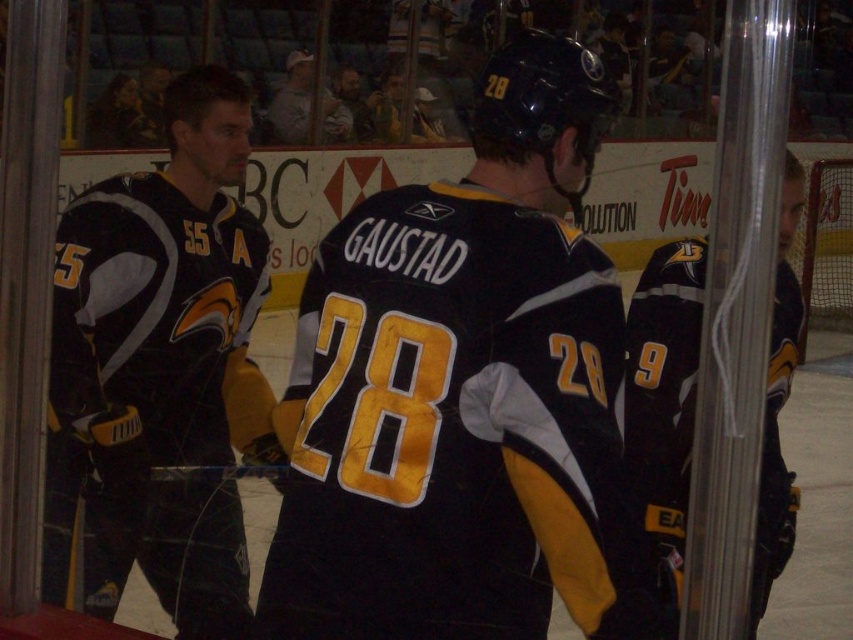
You are a spectator at the hockey game and want to take a photo of both the black jersey at left and the gray cotton shirt at upper center. Which one should you zoom in on first to ensure it fits in the frame?

The black jersey at left is taller than the gray cotton shirt at upper center, so you should zoom in on the black jersey at left first to ensure it fits in the frame.

You are a spectator at a hockey game and want to take a photo of the black jersey at center and the black matte jersey at right. Which jersey should you zoom in on to capture both players in the frame without cropping?

The black jersey at center occupies less space than the black matte jersey at right, so you should zoom in on the black matte jersey at right to ensure both are in frame without cropping.

You are a spectator at a hockey game and notice two items in the image. One is the black matte jersey at right and the other is the gray cotton shirt at upper center. Which of these items is located to the right of the other?

The black matte jersey at right is positioned on the right side of the gray cotton shirt at upper center.